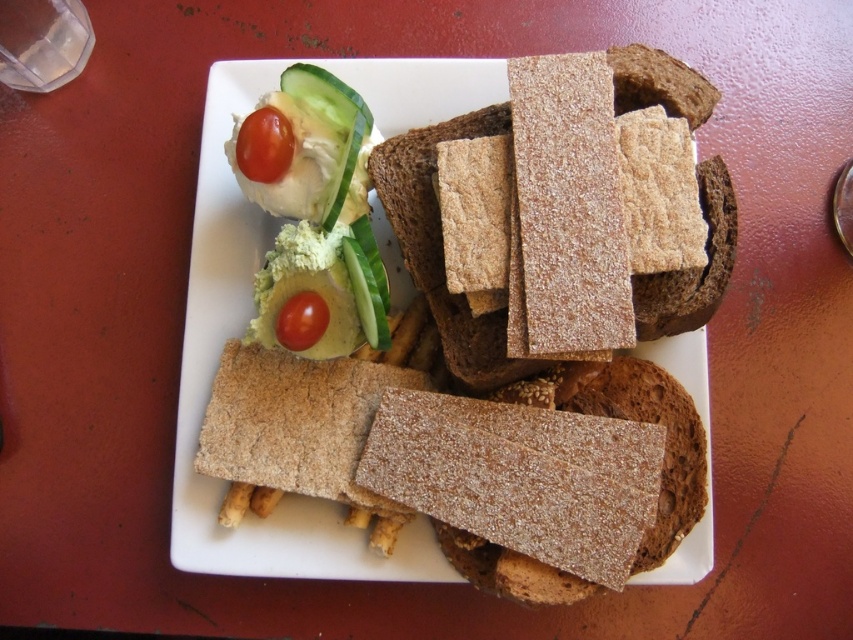
You are a food stylist arranging a photo shoot. You need to place a decorative item between the brown textured bread at center and the glossy red tomato at upper left. Considering their sizes, which object should the decorative item be closer to?

The decorative item should be closer to the glossy red tomato at upper left because the brown textured bread at center is larger, so placing the decorative item closer to the smaller glossy red tomato at upper left would balance the composition.

You are looking at a plate of food on a red table. There is brown textured bread at center and glossy red tomato at center. Which of these two items is positioned to the right?

The brown textured bread at center is to the right of the glossy red tomato at center.

You are standing at a distance of 4 feet from the table. Can you reach the point at coordinates point (x=215, y=244) on the plate without moving closer to the table?

The distance of point (x=215, y=244) is 3.81 feet from the camera, so yes, you can reach it without moving closer since you are already at 4 feet.